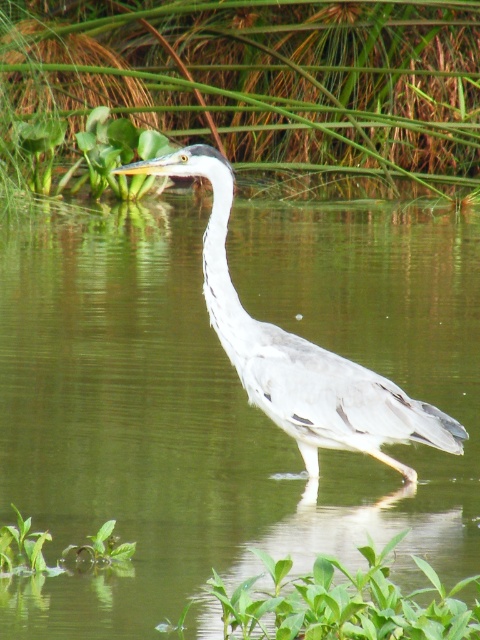
Question: Does green smooth water at center have a larger size compared to gray matte heron at center?

Choices:
 (A) no
 (B) yes

Answer: (B)

Question: Which point appears farthest from the camera in this image?

Choices:
 (A) (417, 237)
 (B) (420, 428)
 (C) (277, 92)

Answer: (C)

Question: In this image, where is green leafy plant at upper center located relative to gray matte heron at center?

Choices:
 (A) left
 (B) right

Answer: (A)

Question: Among these points, which one is nearest to the camera?

Choices:
 (A) (365, 163)
 (B) (211, 419)

Answer: (B)

Question: Among these objects, which one is farthest from the camera?

Choices:
 (A) green smooth water at center
 (B) green leafy plant at upper center
 (C) gray matte heron at center

Answer: (B)

Question: Does green smooth water at center appear on the right side of gray matte heron at center?

Choices:
 (A) yes
 (B) no

Answer: (B)